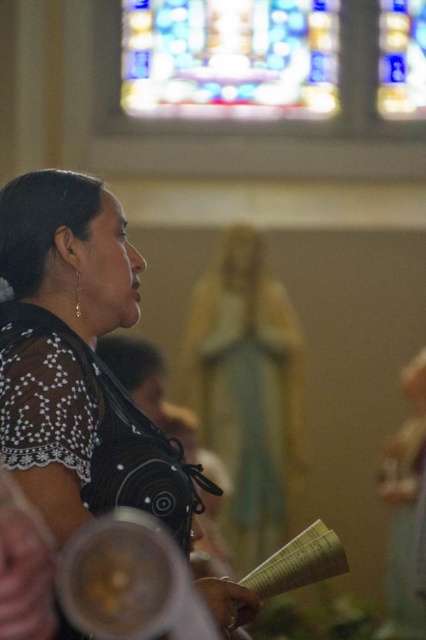
Question: Can you confirm if black lace dress at left is positioned to the left of stained glass window at upper center?

Choices:
 (A) no
 (B) yes

Answer: (B)

Question: Estimate the real-world distances between objects in this image. Which object is farther from the white paper book at lower center?

Choices:
 (A) stained glass window at upper center
 (B) black lace dress at left

Answer: (A)

Question: Which object is the farthest from the black lace dress at left?

Choices:
 (A) stained glass window at upper center
 (B) white paper book at lower center

Answer: (A)

Question: Is black lace dress at left bigger than stained glass window at upper center?

Choices:
 (A) no
 (B) yes

Answer: (B)

Question: Which point appears closest to the camera in this image?

Choices:
 (A) (247, 10)
 (B) (85, 401)
 (C) (307, 532)

Answer: (B)

Question: From the image, what is the correct spatial relationship of black lace dress at left in relation to stained glass window at upper center?

Choices:
 (A) left
 (B) right

Answer: (A)